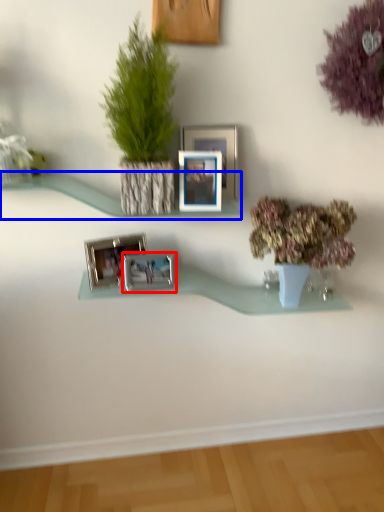
Question: Which object appears closest to the camera in this image, picture frame (highlighted by a red box) or shelf (highlighted by a blue box)?

Choices:
 (A) picture frame
 (B) shelf

Answer: (B)